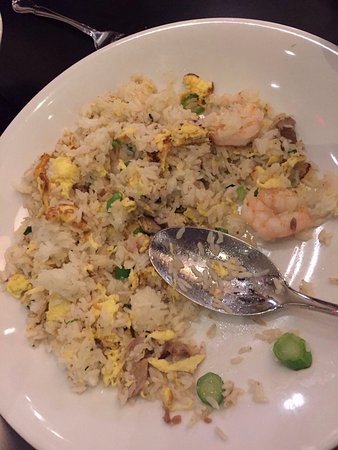
Where is `spoon`? Image resolution: width=338 pixels, height=450 pixels. spoon is located at coordinates coord(250,310).